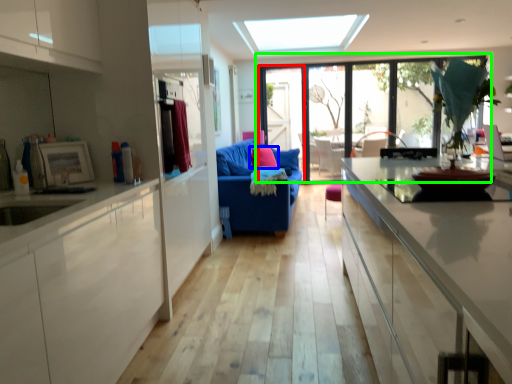
Question: Considering the real-world distances, which object is farthest from screen door (highlighted by a red box)? pillow (highlighted by a blue box) or window (highlighted by a green box)?

Choices:
 (A) pillow
 (B) window

Answer: (A)